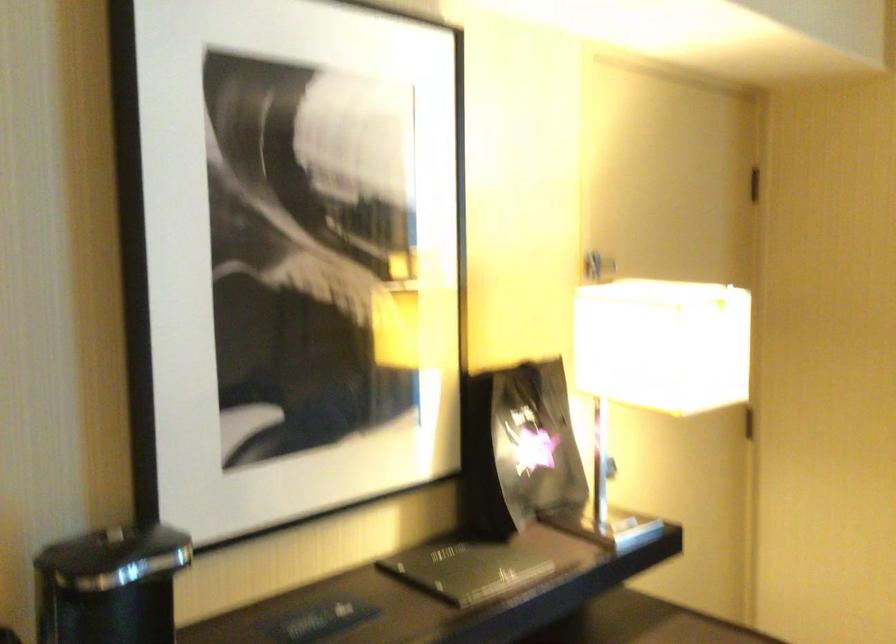
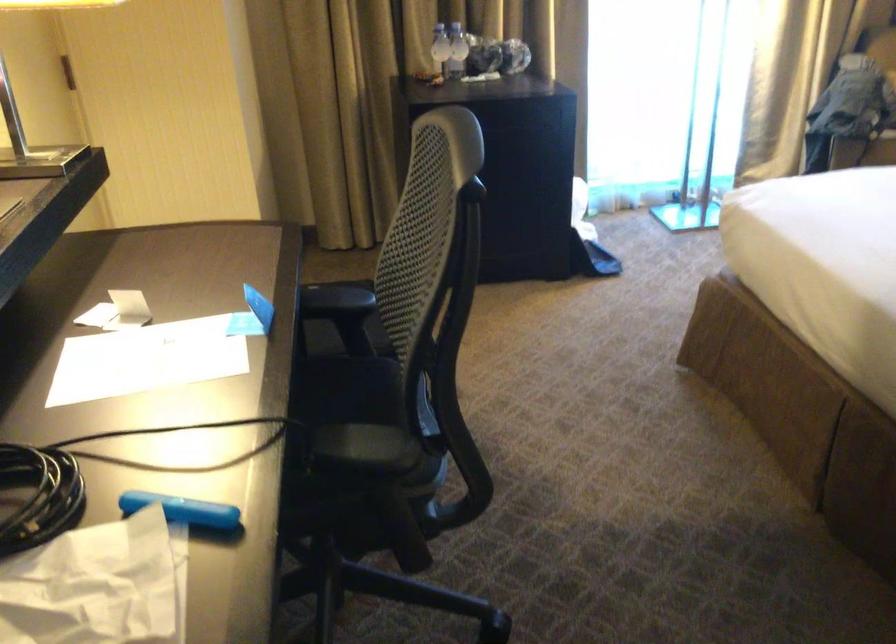
First-person continuous shooting, in which direction is the camera rotating?

The rotation direction of the camera is right-down.